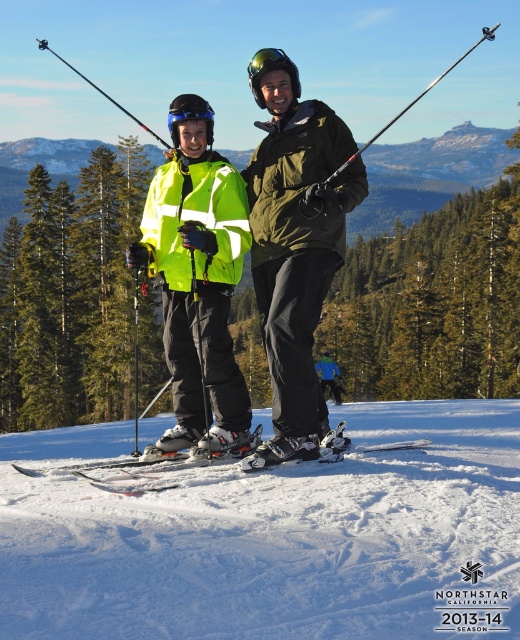
Does white snow at center have a greater height compared to blue reflective lens at upper center?

No.

Is white snow at center positioned before blue reflective lens at upper center?

Yes.

Is point (449, 468) positioned in front of point (196, 116)?

Yes.

Identify the location of white snow at center. The image size is (520, 640). (266, 534).

How far apart are neon yellow jacket at center and blue fabric jacket at center?

The distance of neon yellow jacket at center from blue fabric jacket at center is 30.28 meters.

Is neon yellow jacket at center in front of blue fabric jacket at center?

Yes, neon yellow jacket at center is closer to the viewer.

Who is more distant from viewer, (171,184) or (320,385)?

Positioned behind is point (320,385).

Image resolution: width=520 pixels, height=640 pixels. Find the location of `neon yellow jacket at center`. neon yellow jacket at center is located at coordinates (198, 285).

Between point (435, 628) and point (238, 438), which one is positioned behind?

Positioned behind is point (238, 438).

You are a GUI agent. You are given a task and a screenshot of the screen. Output one action in this format:
    pyautogui.click(x=<x>, y=<y>)
    Task: Click on the white snow at center
    This screenshot has width=520, height=640.
    Given the screenshot: What is the action you would take?
    pyautogui.click(x=266, y=534)